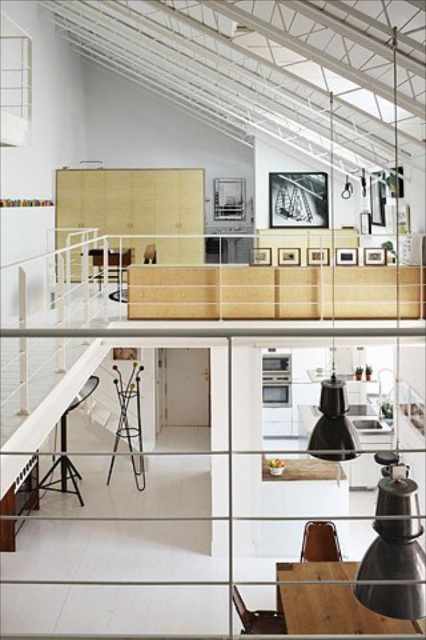
Looking at this image, you are a delivery person carrying a package that requires a 7 meter clearance to pass through the space. Based on the scene, can you safely navigate between the black matte pendant light at center and the metallic stool at lower left without hitting anything?

The distance between the black matte pendant light at center and the metallic stool at lower left is 6.91 meters. Since the required clearance is 7 meters, the distance is slightly insufficient. Therefore, navigating between them might not be safe as the package may hit objects along the path.

You are a painter who needs to hang a 1.5 meter wide canvas between the matte black lampshade at right and the black matte pendant light at center. Can the canvas fit horizontally between them?

The distance between the matte black lampshade at right and the black matte pendant light at center is 2.02 meters. Since the canvas is 1.5 meters wide, it can fit horizontally between them as there is enough space.

You are standing in the dining area and notice the black matte pendant light at center and the metallic stool at lower left. From your perspective, which object is positioned to the right?

The black matte pendant light at center is to the right of the metallic stool at lower left, so the black matte pendant light at center is positioned to the right.